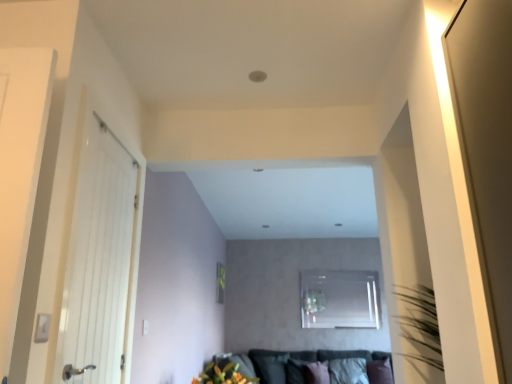
Question: Can you confirm if black fabric pillow at lower center, arranged as the 3th pillow when viewed from the right, is shorter than transparent glass window at center?

Choices:
 (A) no
 (B) yes

Answer: (B)

Question: Does black fabric pillow at lower center, arranged as the 3th pillow when viewed from the right, have a smaller size compared to transparent glass window at center?

Choices:
 (A) no
 (B) yes

Answer: (A)

Question: Is black fabric pillow at lower center, arranged as the 3th pillow when viewed from the right, wider than transparent glass window at center?

Choices:
 (A) no
 (B) yes

Answer: (B)

Question: From a real-world perspective, is black fabric pillow at lower center, which is the first pillow in left-to-right order, positioned under transparent glass window at center based on gravity?

Choices:
 (A) yes
 (B) no

Answer: (A)

Question: Is black fabric pillow at lower center, which is the first pillow in left-to-right order, placed right next to transparent glass window at center?

Choices:
 (A) no
 (B) yes

Answer: (A)

Question: Is black fabric pillow at lower center, which is the first pillow in left-to-right order, in front of transparent glass window at center?

Choices:
 (A) no
 (B) yes

Answer: (B)

Question: Does velvet dark grey couch at lower center appear on the left side of black fabric pillow at lower center, arranged as the 3th pillow when viewed from the right?

Choices:
 (A) no
 (B) yes

Answer: (A)

Question: From the image's perspective, is velvet dark grey couch at lower center below black fabric pillow at lower center, which is the first pillow in left-to-right order?

Choices:
 (A) yes
 (B) no

Answer: (B)

Question: Is velvet dark grey couch at lower center thinner than black fabric pillow at lower center, which is the first pillow in left-to-right order?

Choices:
 (A) no
 (B) yes

Answer: (A)

Question: Is velvet dark grey couch at lower center oriented away from black fabric pillow at lower center, which is the first pillow in left-to-right order?

Choices:
 (A) yes
 (B) no

Answer: (A)

Question: Does velvet dark grey couch at lower center have a larger size compared to black fabric pillow at lower center, arranged as the 3th pillow when viewed from the right?

Choices:
 (A) yes
 (B) no

Answer: (A)

Question: Would you say velvet dark grey couch at lower center is a long distance from black fabric pillow at lower center, arranged as the 3th pillow when viewed from the right?

Choices:
 (A) yes
 (B) no

Answer: (B)

Question: Considering the relative sizes of transparent glass window at center and white fabric pillow at lower center, which appears as the second pillow when viewed from the left, in the image provided, is transparent glass window at center shorter than white fabric pillow at lower center, which appears as the second pillow when viewed from the left,?

Choices:
 (A) yes
 (B) no

Answer: (B)